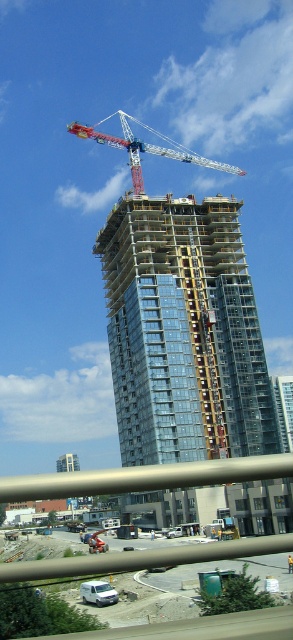
Question: Is red painted metal crane at upper center wider than white matte van at lower center?

Choices:
 (A) no
 (B) yes

Answer: (B)

Question: Which object is the farthest from the glassy steel building at center?

Choices:
 (A) red painted metal crane at upper center
 (B) white matte van at lower center

Answer: (B)

Question: Estimate the real-world distances between objects in this image. Which object is farther from the white concrete construction site at lower center?

Choices:
 (A) glassy steel building at center
 (B) red painted metal crane at upper center
 (C) white matte van at lower center

Answer: (B)

Question: Is white concrete construction site at lower center bigger than red painted metal crane at upper center?

Choices:
 (A) no
 (B) yes

Answer: (A)

Question: Which point is farther to the camera?

Choices:
 (A) red painted metal crane at upper center
 (B) white matte van at lower center
 (C) white concrete construction site at lower center
 (D) glassy steel building at center

Answer: (A)

Question: Can you confirm if white concrete construction site at lower center is smaller than red painted metal crane at upper center?

Choices:
 (A) yes
 (B) no

Answer: (A)